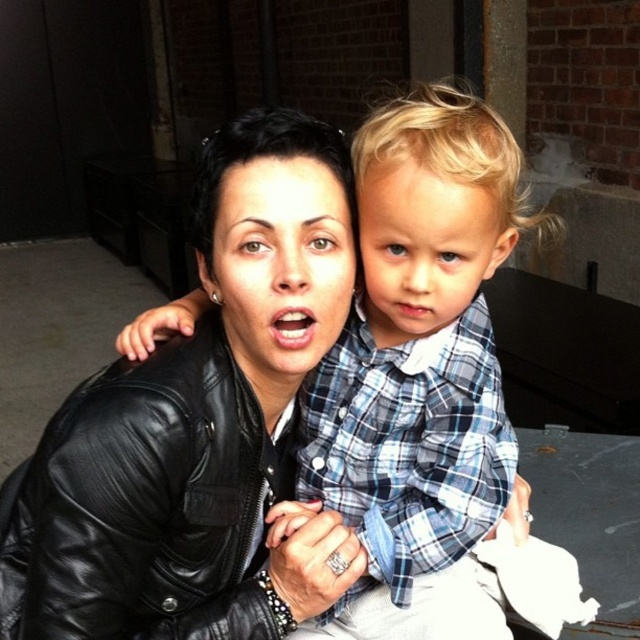
Based on the scene description, which object is taller between the blue plaid shirt at center and the black leather jacket at center?

The blue plaid shirt at center is much taller than the black leather jacket at center.

Based on the scene description, which object is positioned to the right of the other between the blue plaid shirt at center and the black leather jacket at center?

The blue plaid shirt at center is positioned to the right of the black leather jacket at center.

You are standing in the urban setting shown in the image. You see a point at coordinates (419, 376). Where is this point located?

The point at coordinates (419, 376) is located on the blue plaid shirt at center.